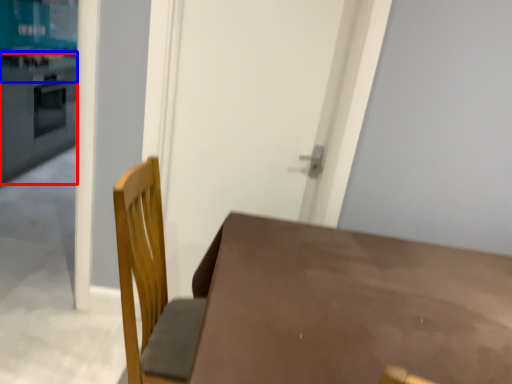
Question: Which object appears closest to the camera in this image, counter top (highlighted by a red box) or counter top (highlighted by a blue box)?

Choices:
 (A) counter top
 (B) counter top

Answer: (A)